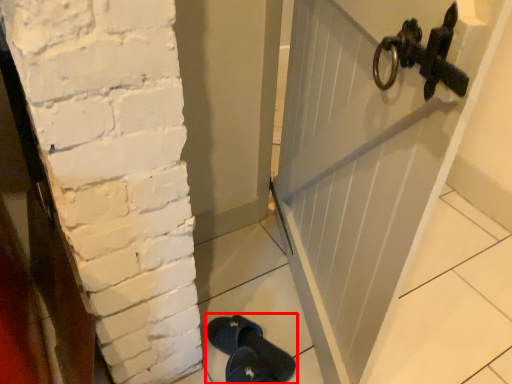
Question: In this image, where is footwear (annotated by the red box) located relative to door?

Choices:
 (A) right
 (B) left

Answer: (B)